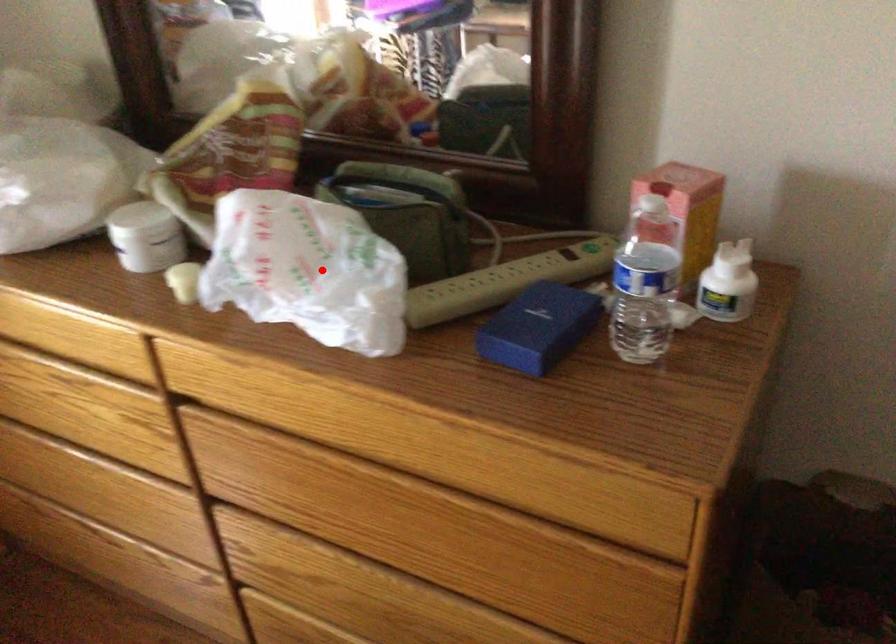
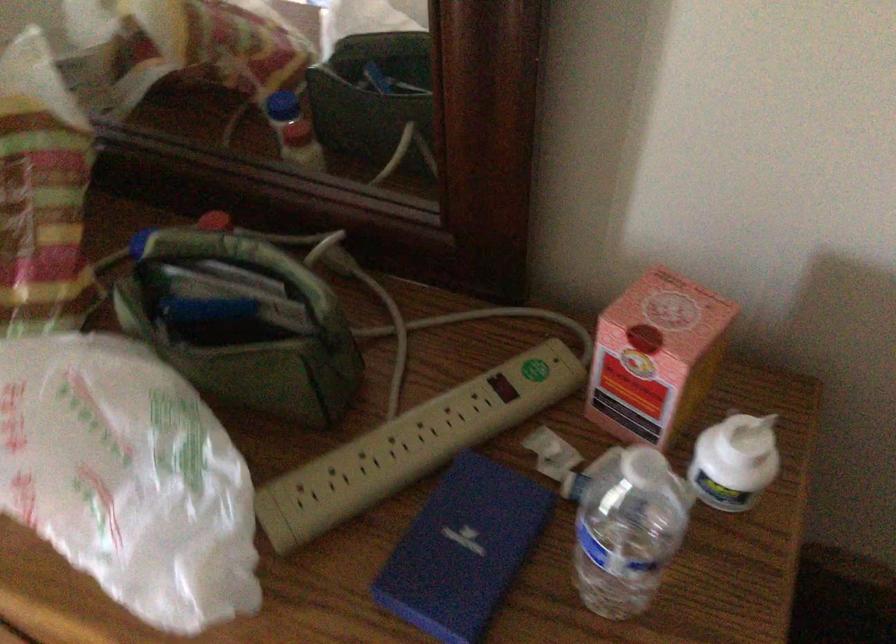
Question: I am providing you with two images of the same scene from different viewpoints. A red point is shown in image1. For the corresponding object point in image2, is it positioned nearer or farther from the camera?

Choices:
 (A) Nearer
 (B) Farther

Answer: (A)